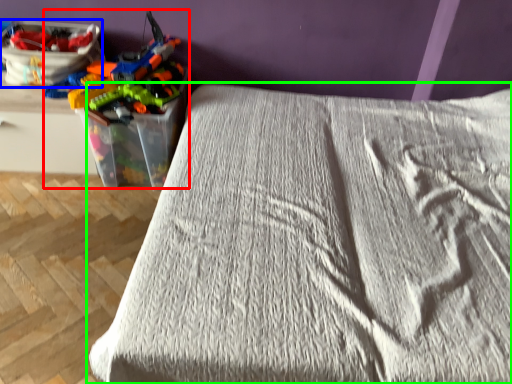
Question: Which object is the farthest from toy (highlighted by a red box)? Choose among these: equipment (highlighted by a blue box) or bed (highlighted by a green box).

Choices:
 (A) equipment
 (B) bed

Answer: (B)